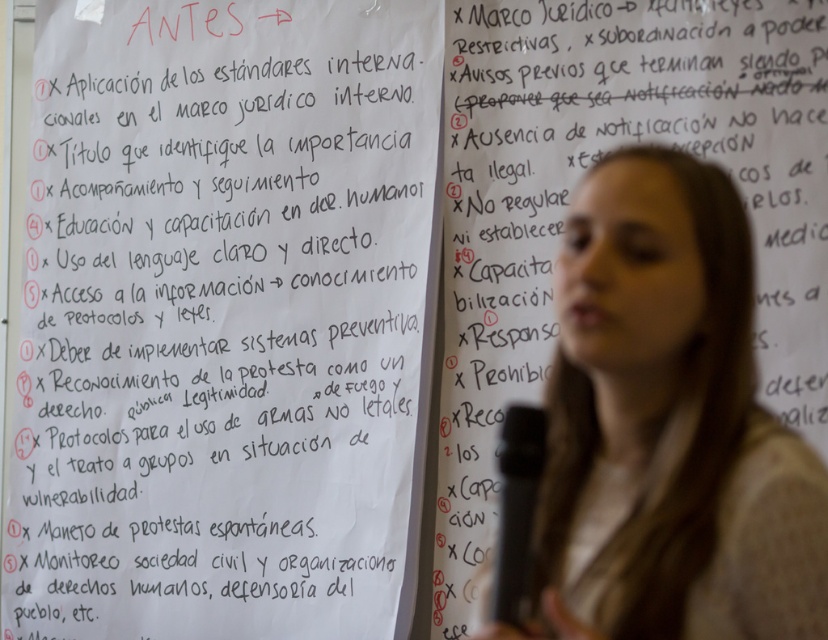
Who is more forward, (391, 280) or (644, 362)?

Point (644, 362) is in front.

In the scene shown: Is white paper at upper left taller than blonde hair at center?

Correct, white paper at upper left is much taller as blonde hair at center.

Is point (272, 387) closer to camera compared to point (727, 248)?

No, (272, 387) is behind (727, 248).

At what (x,y) coordinates should I click in order to perform the action: click on white paper at upper left. Please return your answer as a coordinate pair (x, y). Looking at the image, I should click on (224, 320).

Between blonde hair at center and black plastic microphone at lower center, which one is positioned higher?

blonde hair at center is higher up.

Is point (621, 600) positioned after point (509, 616)?

No, it is not.

Is point (644, 554) in front of point (522, 593)?

Yes.

At what (x,y) coordinates should I click in order to perform the action: click on blonde hair at center. Please return your answer as a coordinate pair (x, y). Looking at the image, I should click on (668, 426).

Who is higher up, white paper at upper left or black plastic microphone at lower center?

Positioned higher is white paper at upper left.

Is point (162, 589) closer to viewer compared to point (528, 497)?

No, it is behind (528, 497).

Where is `white paper at upper left`? white paper at upper left is located at coordinates (224, 320).